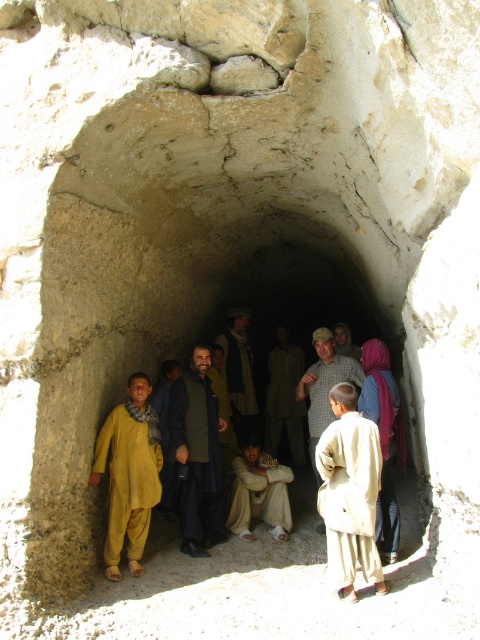
You are standing inside the narrow stone tunnel and notice two items hanging on the wall at the center. The light beige fabric robe at center and the dark brown woolen coat at center. Which one is closer to you?

The light beige fabric robe at center is closer to you since it is in front of the dark brown woolen coat at center.

You are a tour guide leading a group through this narrow stone tunnel. You notice the light beige fabric robe at center and the light purple fabric at center. If you want to ensure a safe path for visitors, what is the minimum width the path must be to accommodate both items without them touching?

The minimum width required is 24.19 inches to ensure the light beige fabric robe at center and the light purple fabric at center do not touch.